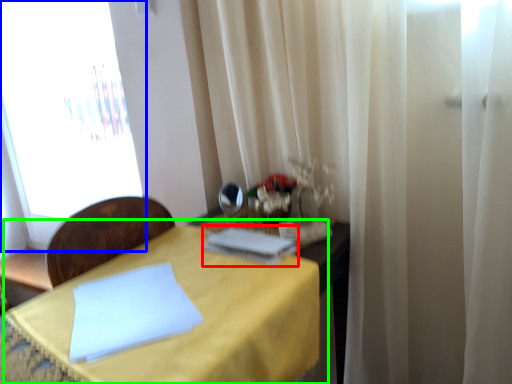
Question: Considering the real-world distances, which object is closest to book (highlighted by a red box)? window (highlighted by a blue box) or table (highlighted by a green box).

Choices:
 (A) window
 (B) table

Answer: (B)